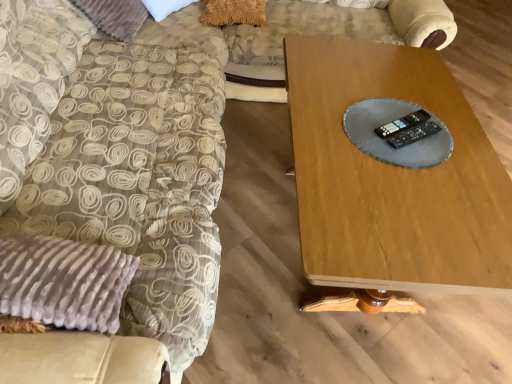
Question: Is velvet beige swivel chair at left situated inside black plastic remote at center, the 2th control in the top-to-bottom sequence, or outside?

Choices:
 (A) inside
 (B) outside

Answer: (B)

Question: Is point (189, 359) closer or farther from the camera than point (419, 125)?

Choices:
 (A) closer
 (B) farther

Answer: (A)

Question: Which is farther from the velvet beige swivel chair at left?

Choices:
 (A) wooden table at center
 (B) black plastic remote at center, the first control positioned from the top
 (C) black plastic remote at center, which is the first control from bottom to top

Answer: (C)

Question: Which of these objects is positioned farthest from the wooden table at center?

Choices:
 (A) black plastic remote at center, the 2th control in the top-to-bottom sequence
 (B) velvet beige swivel chair at left
 (C) black plastic remote at center, the first control positioned from the top

Answer: (B)